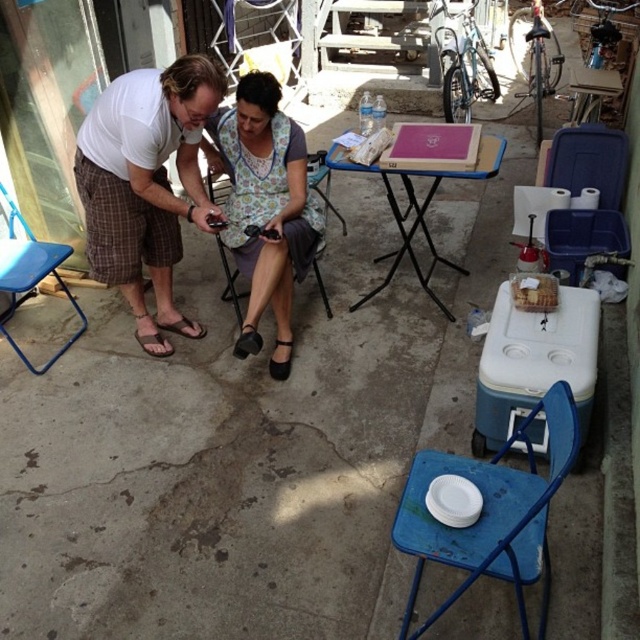
You are organizing a small event and need to arrange seating. You have a floral fabric dress at center and a blue metal folding chair at lower right. Which object is wider?

The floral fabric dress at center is wider than the blue metal folding chair at lower right according to the description.

You are a photographer setting up for an event and need to position a tripod. You see the floral fabric dress at center and the blue metal folding chair at lower right. Which object should you place the tripod closer to if you want it near the lower part of the scene?

The blue metal folding chair at lower right is located lower in the scene, so placing the tripod closer to it would position it near the lower part.